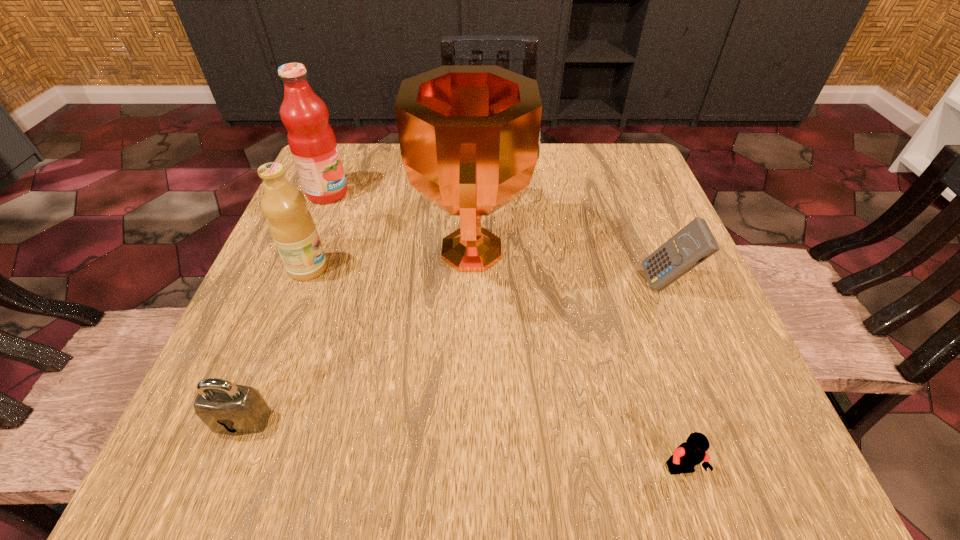
At what (x,y) coordinates should I click in order to perform the action: click on padlock that is at the left edge. Please return your answer as a coordinate pair (x, y). Looking at the image, I should click on (226, 408).

Identify the location of calculator that is at the right edge. (694, 243).

The height and width of the screenshot is (540, 960). I want to click on Lego that is positioned at the right edge, so click(x=686, y=456).

In order to click on object located at the far left corner in this screenshot , I will do `click(311, 139)`.

Identify the location of object present at the near left corner. (226, 408).

Locate an element on the screen. The image size is (960, 540). object located at the near right corner is located at coordinates (686, 456).

In the image, there is a desktop. In order to click on free region at the far edge in this screenshot , I will do `click(553, 179)`.

You are a GUI agent. You are given a task and a screenshot of the screen. Output one action in this format:
    pyautogui.click(x=<x>, y=<y>)
    Task: Click on the free space at the near edge of the desktop
    The image size is (960, 540).
    Given the screenshot: What is the action you would take?
    pyautogui.click(x=390, y=468)

At what (x,y) coordinates should I click in order to perform the action: click on free location at the left edge of the desktop. Please return your answer as a coordinate pair (x, y). The image size is (960, 540). Looking at the image, I should click on (295, 316).

Locate an element on the screen. The image size is (960, 540). blank space at the right edge of the desktop is located at coordinates [616, 204].